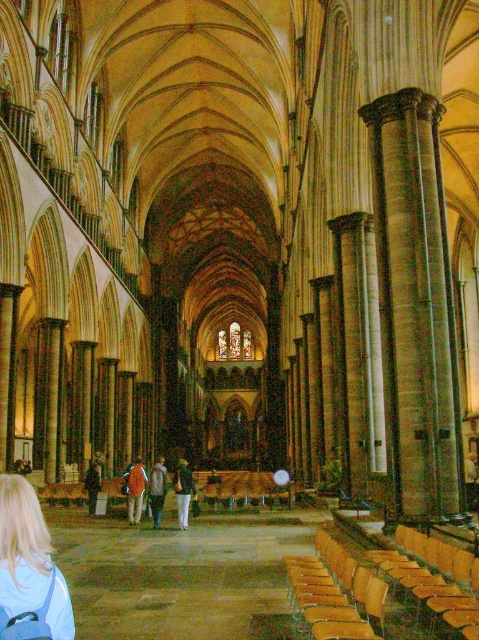
Question: Observing the image, what is the correct spatial positioning of blonde hair at lower left in reference to orange fabric pants at center?

Choices:
 (A) below
 (B) above

Answer: (B)

Question: Which of these objects is positioned farthest from the blonde hair at lower left?

Choices:
 (A) green textured shirt at center
 (B) denim jacket at center
 (C) dark brown leather jacket at lower left

Answer: (C)

Question: Which of the following is the farthest from the observer?

Choices:
 (A) click(x=151, y=500)
 (B) click(x=55, y=595)
 (C) click(x=449, y=598)
 (D) click(x=182, y=458)

Answer: (D)

Question: Considering the relative positions of orange fabric pants at center and dark brown leather jacket at lower left in the image provided, where is orange fabric pants at center located with respect to dark brown leather jacket at lower left?

Choices:
 (A) left
 (B) right

Answer: (B)

Question: Can you confirm if blonde hair at lower left is thinner than orange fabric pants at center?

Choices:
 (A) yes
 (B) no

Answer: (A)

Question: Based on their relative distances, which object is farther from the denim jacket at center?

Choices:
 (A) blonde hair at lower left
 (B) orange fabric pants at center

Answer: (A)